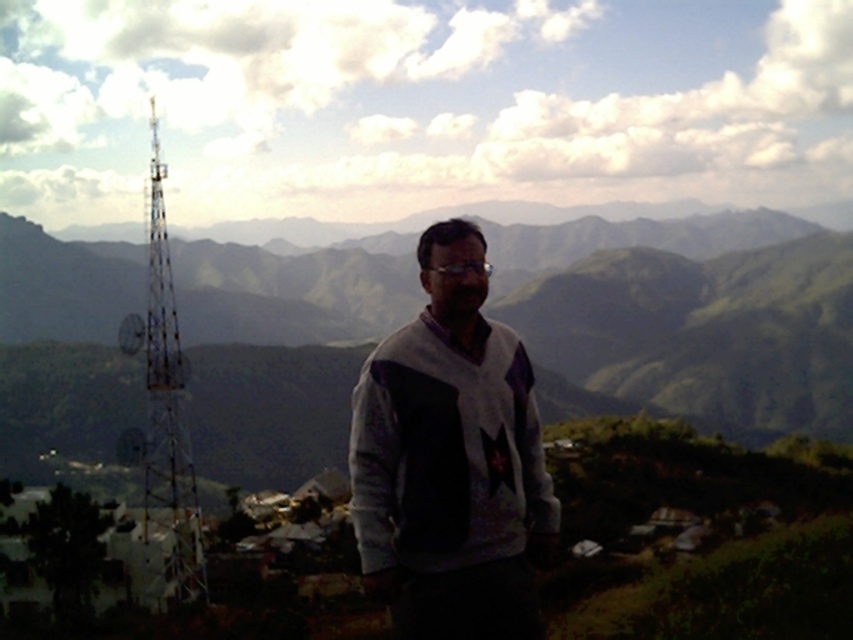
Question: Which point is closer to the camera?

Choices:
 (A) white knitwear at center
 (B) green grassy mountain at center

Answer: (A)

Question: Is green grassy mountain at center positioned in front of white knitwear at center?

Choices:
 (A) no
 (B) yes

Answer: (A)

Question: Which of the following is the farthest from the observer?

Choices:
 (A) green grassy mountain at center
 (B) white knitwear at center

Answer: (A)

Question: Does green grassy mountain at center appear on the right side of white knitwear at center?

Choices:
 (A) yes
 (B) no

Answer: (A)

Question: Considering the relative positions of green grassy mountain at center and white knitwear at center in the image provided, where is green grassy mountain at center located with respect to white knitwear at center?

Choices:
 (A) right
 (B) left

Answer: (A)

Question: Which object appears farthest from the camera in this image?

Choices:
 (A) white knitwear at center
 (B) green grassy mountain at center

Answer: (B)